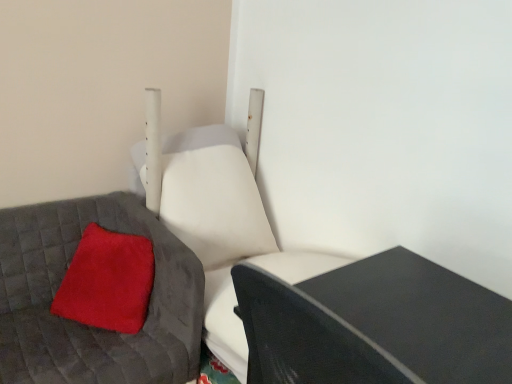
Question: Is the position of white leather swivel chair at center less distant than that of velvety red pillow at left?

Choices:
 (A) yes
 (B) no

Answer: (B)

Question: From a real-world perspective, is white leather swivel chair at center on top of velvety red pillow at left?

Choices:
 (A) yes
 (B) no

Answer: (A)

Question: Can you confirm if white leather swivel chair at center is wider than velvety red pillow at left?

Choices:
 (A) no
 (B) yes

Answer: (B)

Question: Does white leather swivel chair at center lie behind velvety red pillow at left?

Choices:
 (A) no
 (B) yes

Answer: (B)

Question: Would you say white leather swivel chair at center contains velvety red pillow at left?

Choices:
 (A) no
 (B) yes

Answer: (A)

Question: Is white leather swivel chair at center shorter than velvety red pillow at left?

Choices:
 (A) yes
 (B) no

Answer: (B)

Question: From the image's perspective, is velvety red pillow at left located above fuzzy red pillow at lower left?

Choices:
 (A) no
 (B) yes

Answer: (A)

Question: Can you confirm if velvety red pillow at left is thinner than fuzzy red pillow at lower left?

Choices:
 (A) no
 (B) yes

Answer: (A)

Question: Is velvety red pillow at left to the right of fuzzy red pillow at lower left from the viewer's perspective?

Choices:
 (A) yes
 (B) no

Answer: (B)

Question: Is velvety red pillow at left not within fuzzy red pillow at lower left?

Choices:
 (A) yes
 (B) no

Answer: (A)

Question: Would you say fuzzy red pillow at lower left is part of velvety red pillow at left's contents?

Choices:
 (A) yes
 (B) no

Answer: (A)

Question: Does velvety red pillow at left have a smaller size compared to fuzzy red pillow at lower left?

Choices:
 (A) yes
 (B) no

Answer: (B)

Question: Is velvety red pillow at left outside of white leather swivel chair at center?

Choices:
 (A) yes
 (B) no

Answer: (A)